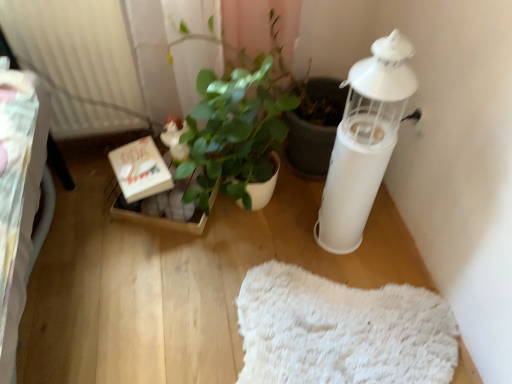
Question: In terms of width, does wooden cardboard box at center, marked as the second cardboard box in a front-to-back arrangement, look wider or thinner when compared to green glossy plant at center?

Choices:
 (A) wide
 (B) thin

Answer: (B)

Question: From their relative heights in the image, would you say wooden cardboard box at center, marked as the second cardboard box in a front-to-back arrangement, is taller or shorter than green glossy plant at center?

Choices:
 (A) short
 (B) tall

Answer: (A)

Question: Based on their relative distances, which object is nearer to the white ribbed radiator at upper left?

Choices:
 (A) green glossy plant at center
 (B) white fluffy mat at lower center
 (C) white cardboard box at center, arranged as the 1th cardboard box when viewed from the front
 (D) white matte candle holder at right
 (E) wooden cardboard box at center, the 1th cardboard box viewed from the back

Answer: (C)

Question: Which object is the closest to the white matte candle holder at right?

Choices:
 (A) wooden cardboard box at center, the 1th cardboard box viewed from the back
 (B) white fluffy mat at lower center
 (C) green glossy plant at center
 (D) white cardboard box at center, which appears as the second cardboard box when viewed from the back
 (E) white ribbed radiator at upper left

Answer: (C)